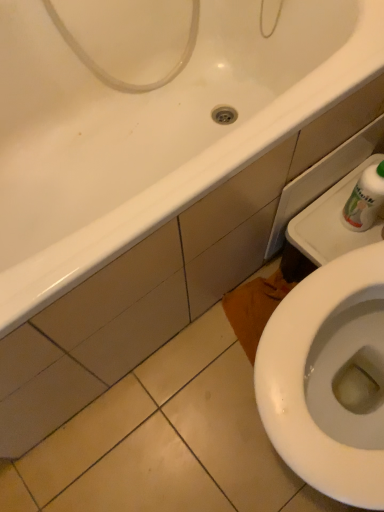
Question: From a real-world perspective, is white glossy bathtub at upper left physically located above or below white plastic bottle at upper right?

Choices:
 (A) above
 (B) below

Answer: (B)

Question: Is white glossy bathtub at upper left spatially inside white plastic bottle at upper right, or outside of it?

Choices:
 (A) outside
 (B) inside

Answer: (A)

Question: In terms of size, does white glossy bathtub at upper left appear bigger or smaller than white plastic bottle at upper right?

Choices:
 (A) small
 (B) big

Answer: (B)

Question: From the image's perspective, is white plastic bottle at upper right located above or below white glossy bathtub at upper left?

Choices:
 (A) above
 (B) below

Answer: (B)

Question: In terms of width, does white plastic bottle at upper right look wider or thinner when compared to white glossy bathtub at upper left?

Choices:
 (A) wide
 (B) thin

Answer: (B)

Question: Is white plastic bottle at upper right to the left or to the right of white glossy bathtub at upper left in the image?

Choices:
 (A) right
 (B) left

Answer: (A)

Question: Is white plastic bottle at upper right in front of or behind white glossy bathtub at upper left in the image?

Choices:
 (A) behind
 (B) front

Answer: (A)